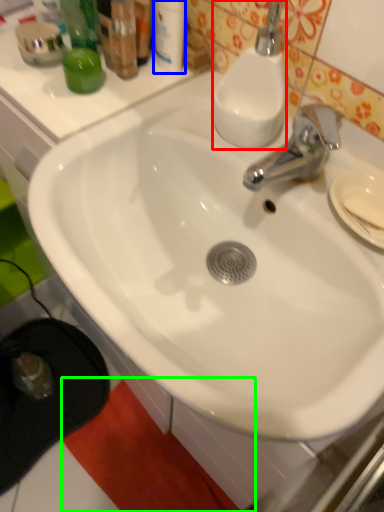
Question: Considering the real-world distances, which object is closest to soap dispenser (highlighted by a red box)? toiletry (highlighted by a blue box) or beach towel (highlighted by a green box).

Choices:
 (A) toiletry
 (B) beach towel

Answer: (A)